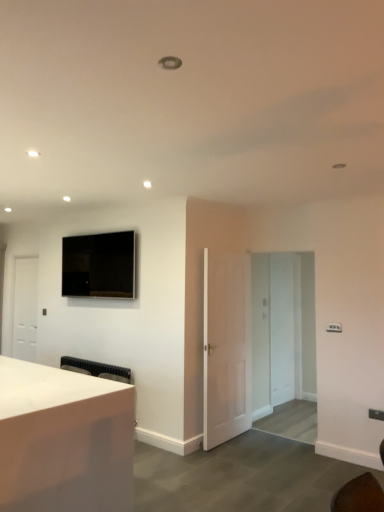
Question: Considering their positions, is white matte door at center, which is the 2th door from left to right, located in front of or behind white matte door at left, the 2th door from the front?

Choices:
 (A) behind
 (B) front

Answer: (B)

Question: From the image's perspective, is white matte door at center, which is the 1th door in front-to-back order, above or below white matte door at left, the first door when ordered from back to front?

Choices:
 (A) above
 (B) below

Answer: (B)

Question: Estimate the real-world distances between objects in this image. Which object is farther from the white matte door at center, which is the 1th door in front-to-back order?

Choices:
 (A) matte black tv at upper left
 (B) transparent glass door at center
 (C) white matte door at left, the 1th door positioned from the left
 (D) white glossy desk at lower left

Answer: (C)

Question: Based on their relative distances, which object is farther from the transparent glass door at center?

Choices:
 (A) matte black tv at upper left
 (B) white matte door at left, the first door when ordered from back to front
 (C) white matte door at center, which is the 2th door from left to right
 (D) white glossy desk at lower left

Answer: (B)